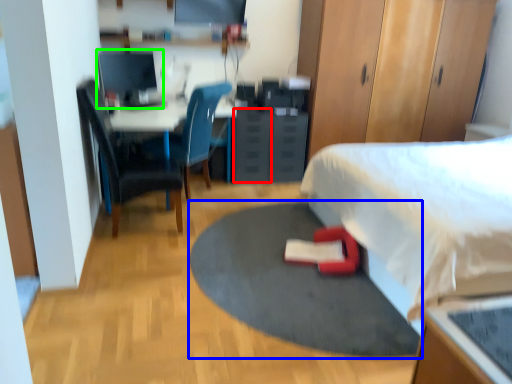
Question: Based on their relative distances, which object is farther from drawer (highlighted by a red box)? Choose from yoga mat (highlighted by a blue box) and computer monitor (highlighted by a green box).

Choices:
 (A) yoga mat
 (B) computer monitor

Answer: (A)